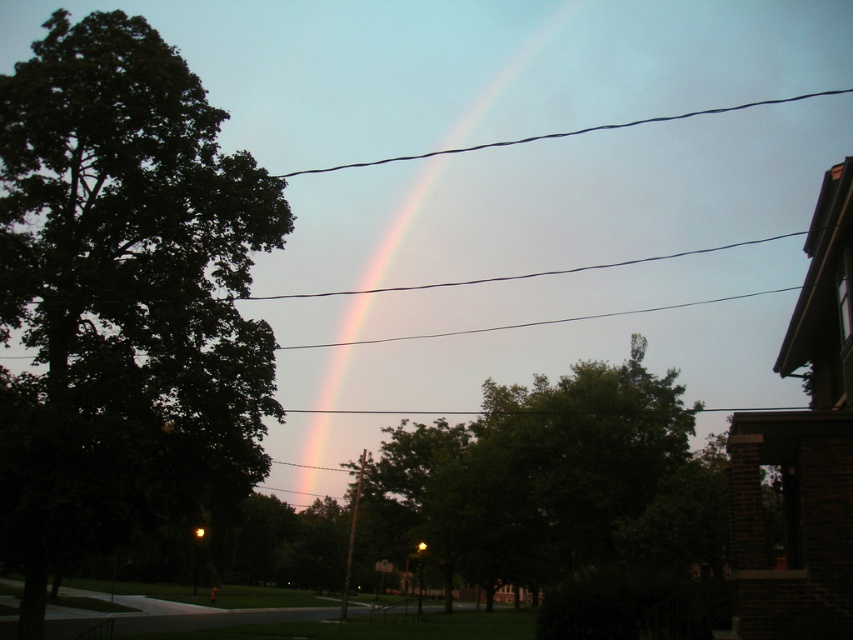
Looking at this image, you are an artist trying to paint the scene. You want to ensure the green leafy tree at left and the rainbow at center are positioned correctly in terms of depth. Based on the scene, which object should appear in front of the other?

The green leafy tree at left is closer to the viewer than the rainbow at center, so it should be painted in front of the rainbow at center to maintain proper depth perception.

You are an artist trying to sketch this scene. You notice the green leafy tree at left and the black wire at upper center. Which object should you draw first if you want to follow the rule of drawing smaller objects before larger ones?

The green leafy tree at left should be drawn first because it is smaller than the black wire at upper center.